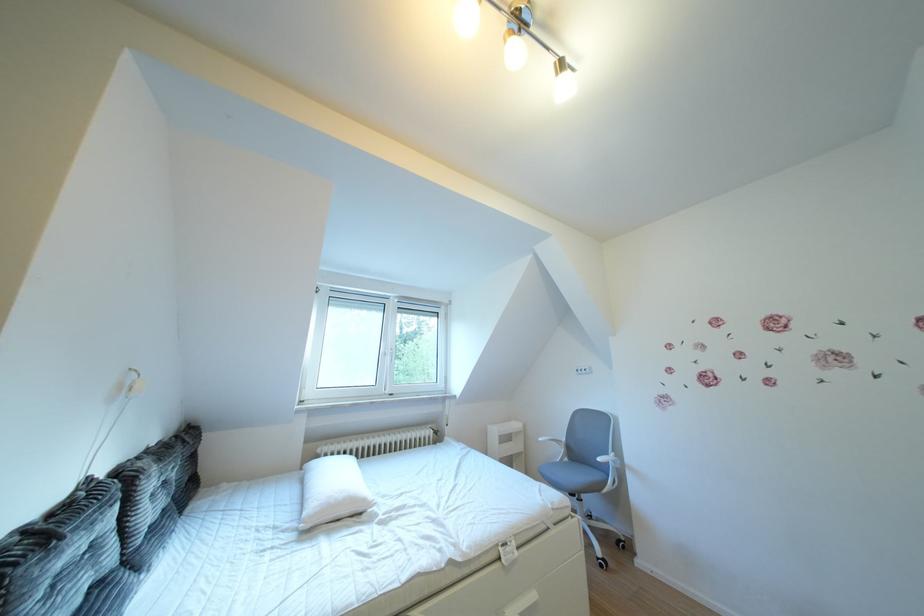
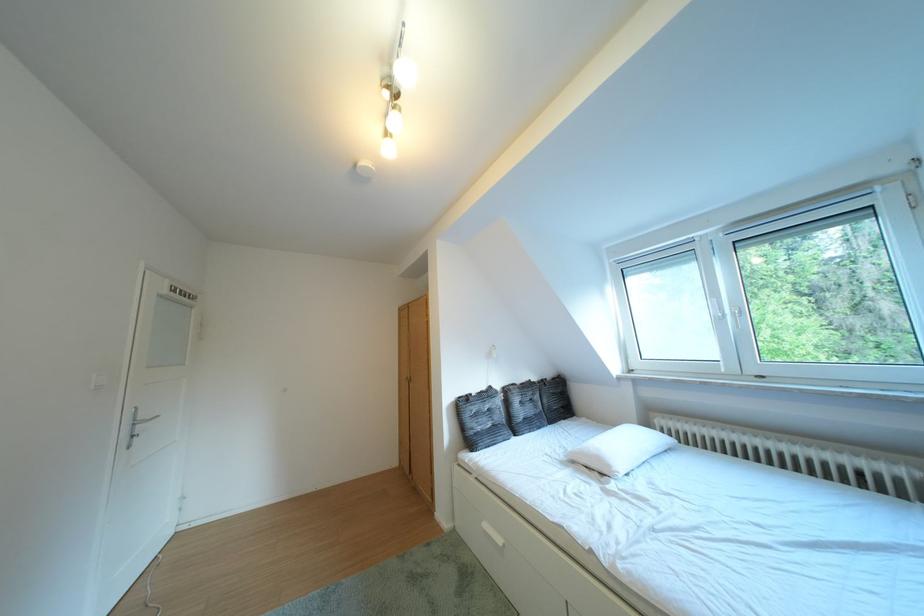
Where in the second image is the point corresponding to point (103, 485) from the first image?

(504, 392)